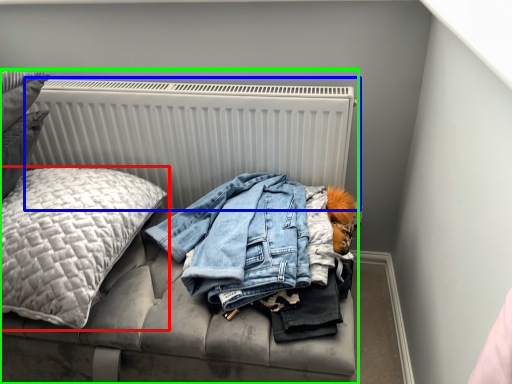
Question: Which object is the farthest from pillow (highlighted by a red box)? Choose among these: radiator (highlighted by a blue box) or furniture (highlighted by a green box).

Choices:
 (A) radiator
 (B) furniture

Answer: (B)